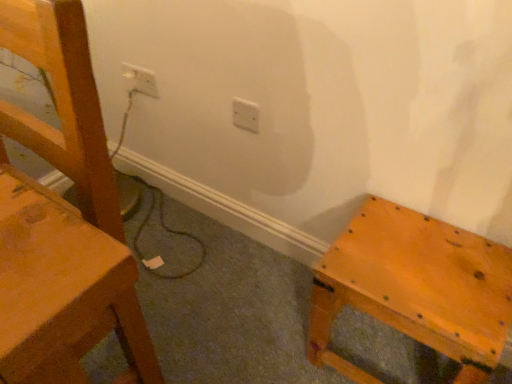
Question: Can you confirm if matte wood chair at left is wider than matte wooden stool at lower right?

Choices:
 (A) yes
 (B) no

Answer: (B)

Question: From the image's perspective, is matte wood chair at left beneath matte wooden stool at lower right?

Choices:
 (A) no
 (B) yes

Answer: (A)

Question: Considering the relative positions of matte wood chair at left and matte wooden stool at lower right in the image provided, is matte wood chair at left to the left of matte wooden stool at lower right from the viewer's perspective?

Choices:
 (A) no
 (B) yes

Answer: (B)

Question: Can you confirm if matte wood chair at left is thinner than matte wooden stool at lower right?

Choices:
 (A) no
 (B) yes

Answer: (B)

Question: Is matte wood chair at left to the right of matte wooden stool at lower right from the viewer's perspective?

Choices:
 (A) yes
 (B) no

Answer: (B)

Question: From a real-world perspective, is white plastic electric outlet at center, which appears as the first electric outlet when viewed from the right, above or below matte wood chair at left?

Choices:
 (A) below
 (B) above

Answer: (A)

Question: Considering the relative positions of white plastic electric outlet at center, which appears as the second electric outlet when viewed from the left, and matte wood chair at left in the image provided, is white plastic electric outlet at center, which appears as the second electric outlet when viewed from the left, to the left or to the right of matte wood chair at left?

Choices:
 (A) left
 (B) right

Answer: (B)

Question: From the image's perspective, is white plastic electric outlet at center, the second electric outlet when ordered from back to front, located above or below matte wood chair at left?

Choices:
 (A) above
 (B) below

Answer: (A)

Question: Is white plastic electric outlet at center, which is the first electric outlet in bottom-to-top order, inside the boundaries of matte wood chair at left, or outside?

Choices:
 (A) inside
 (B) outside

Answer: (B)

Question: Looking at their shapes, would you say white plastic electric outlet at center, which is the 2th electric outlet in top-to-bottom order, is wider or thinner than matte wooden stool at lower right?

Choices:
 (A) wide
 (B) thin

Answer: (B)

Question: From a real-world perspective, is white plastic electric outlet at center, the first electric outlet when ordered from front to back, above or below matte wooden stool at lower right?

Choices:
 (A) above
 (B) below

Answer: (A)

Question: Visually, is white plastic electric outlet at center, the second electric outlet when ordered from back to front, positioned to the left or to the right of matte wooden stool at lower right?

Choices:
 (A) right
 (B) left

Answer: (B)

Question: Is white plastic electric outlet at center, which is the first electric outlet in bottom-to-top order, bigger or smaller than matte wooden stool at lower right?

Choices:
 (A) small
 (B) big

Answer: (A)

Question: Considering the positions of matte wood chair at left and white plastic electric outlet at upper left, which ranks as the 2th electric outlet in right-to-left order, in the image, is matte wood chair at left bigger or smaller than white plastic electric outlet at upper left, which ranks as the 2th electric outlet in right-to-left order,?

Choices:
 (A) small
 (B) big

Answer: (B)

Question: Is point (83, 235) closer or farther from the camera than point (133, 77)?

Choices:
 (A) closer
 (B) farther

Answer: (A)